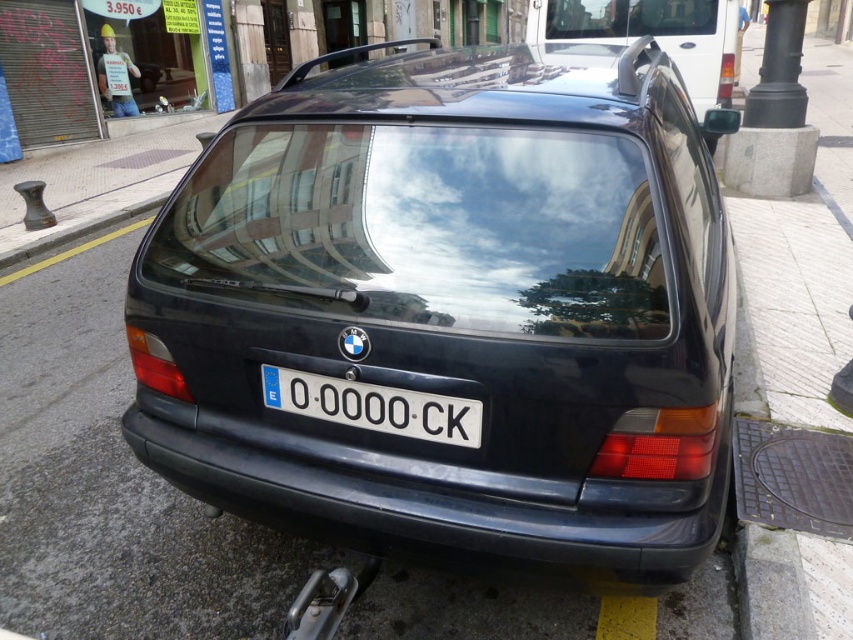
From the picture: You are standing in front of the parked BMW station wagon. You notice two points marked on the car. The first point is at coordinate point (448,241) and the second is at point (260,371). Which point is closer to you?

Point (448,241) is closer to the viewer than point (260,371).

You are a driver approaching the parked BMW station wagon from the front. You notice two points on the car, one at coordinate point (612, 20) and another at point (393, 400). Which point would appear closer to you as you look at the car from the front?

Point (393, 400) is closer to you because it is less further to the camera than point (612, 20).